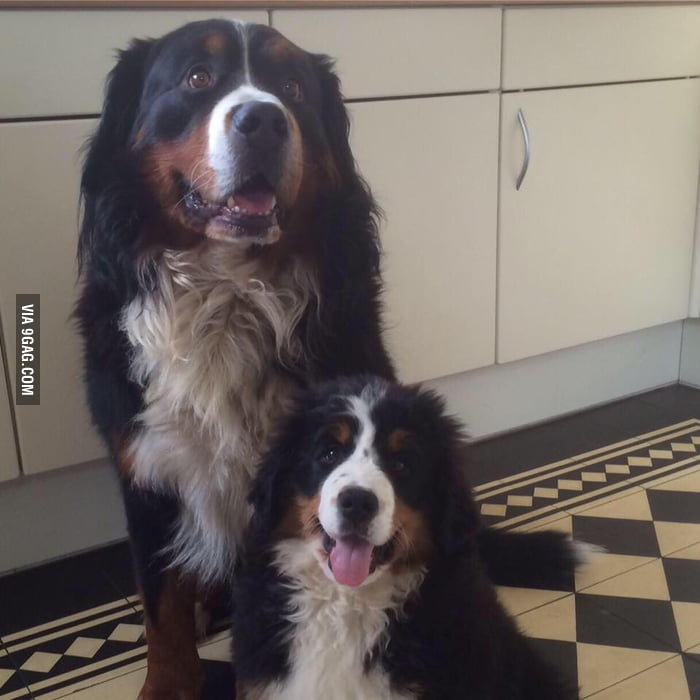
The height and width of the screenshot is (700, 700). Find the location of `drawer`. drawer is located at coordinates (463, 35).